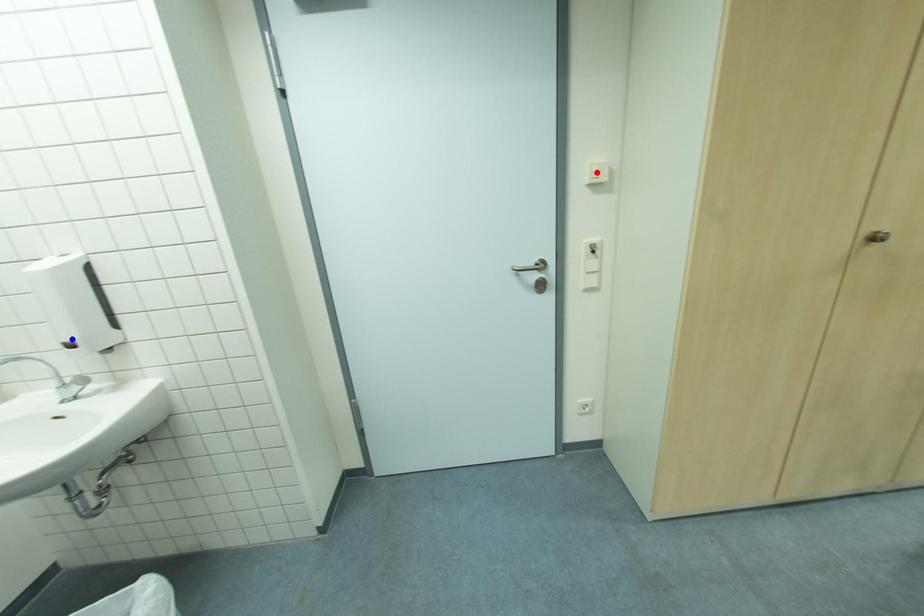
Question: Which of the two points in the image is closer to the camera?

Choices:
 (A) Blue point is closer.
 (B) Red point is closer.

Answer: (A)